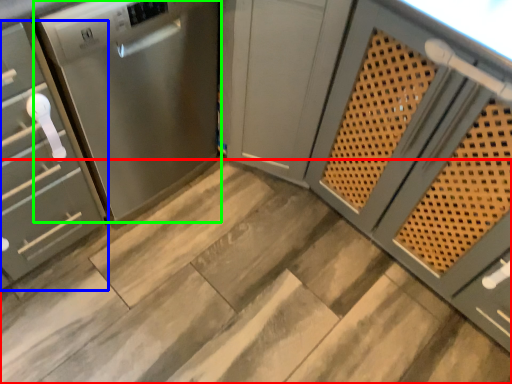
Question: Considering the real-world distances, which object is closest to stair (highlighted by a red box)? cabinetry (highlighted by a blue box) or home appliance (highlighted by a green box).

Choices:
 (A) cabinetry
 (B) home appliance

Answer: (B)